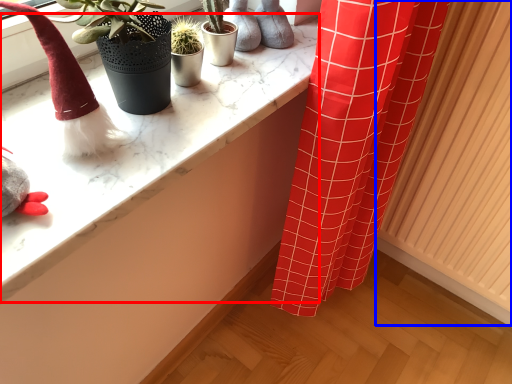
Question: Among these objects, which one is nearest to the camera, counter top (highlighted by a red box) or radiator (highlighted by a blue box)?

Choices:
 (A) counter top
 (B) radiator

Answer: (A)